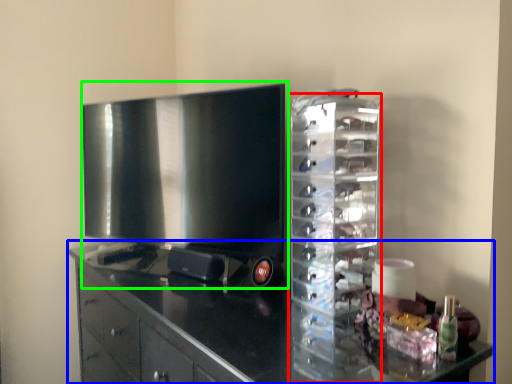
Question: Considering the real-world distances, which object is closest to glass box (highlighted by a red box)? cabinetry (highlighted by a blue box) or home appliance (highlighted by a green box).

Choices:
 (A) cabinetry
 (B) home appliance

Answer: (A)